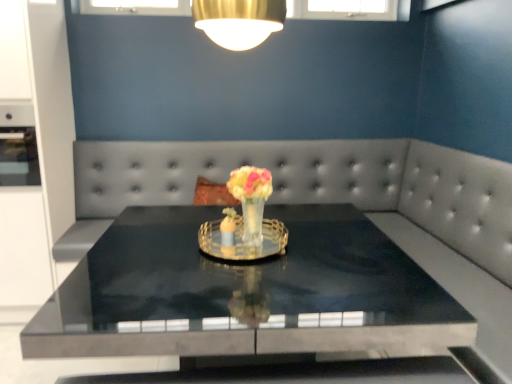
Question: From the image's perspective, is translucent glass vase at center below satin gray couch at center?

Choices:
 (A) no
 (B) yes

Answer: (A)

Question: Considering the relative sizes of translucent glass vase at center and satin gray couch at center in the image provided, is translucent glass vase at center smaller than satin gray couch at center?

Choices:
 (A) yes
 (B) no

Answer: (A)

Question: Is translucent glass vase at center in front of satin gray couch at center?

Choices:
 (A) yes
 (B) no

Answer: (A)

Question: Is there a large distance between translucent glass vase at center and satin gray couch at center?

Choices:
 (A) no
 (B) yes

Answer: (B)

Question: Can you confirm if translucent glass vase at center is shorter than satin gray couch at center?

Choices:
 (A) yes
 (B) no

Answer: (A)

Question: From their relative heights in the image, would you say satin gray couch at center is taller or shorter than translucent glass vase at center?

Choices:
 (A) tall
 (B) short

Answer: (A)

Question: In terms of size, does satin gray couch at center appear bigger or smaller than translucent glass vase at center?

Choices:
 (A) small
 (B) big

Answer: (B)

Question: Which is correct: satin gray couch at center is inside translucent glass vase at center, or outside of it?

Choices:
 (A) outside
 (B) inside

Answer: (A)

Question: Relative to translucent glass vase at center, is satin gray couch at center in front or behind?

Choices:
 (A) front
 (B) behind

Answer: (B)

Question: Considering their positions, is translucent glass vase at center located in front of or behind satin gray couch at center?

Choices:
 (A) front
 (B) behind

Answer: (A)

Question: From the image's perspective, is translucent glass vase at center located above or below satin gray couch at center?

Choices:
 (A) below
 (B) above

Answer: (B)

Question: Considering the positions of translucent glass vase at center and satin gray couch at center in the image, is translucent glass vase at center taller or shorter than satin gray couch at center?

Choices:
 (A) tall
 (B) short

Answer: (B)

Question: Choose the correct answer: Is translucent glass vase at center inside satin gray couch at center or outside it?

Choices:
 (A) inside
 (B) outside

Answer: (B)

Question: Considering their positions, is black polished table at center located in front of or behind translucent glass vase at center?

Choices:
 (A) front
 (B) behind

Answer: (A)

Question: In the image, is black polished table at center on the left side or the right side of translucent glass vase at center?

Choices:
 (A) left
 (B) right

Answer: (B)